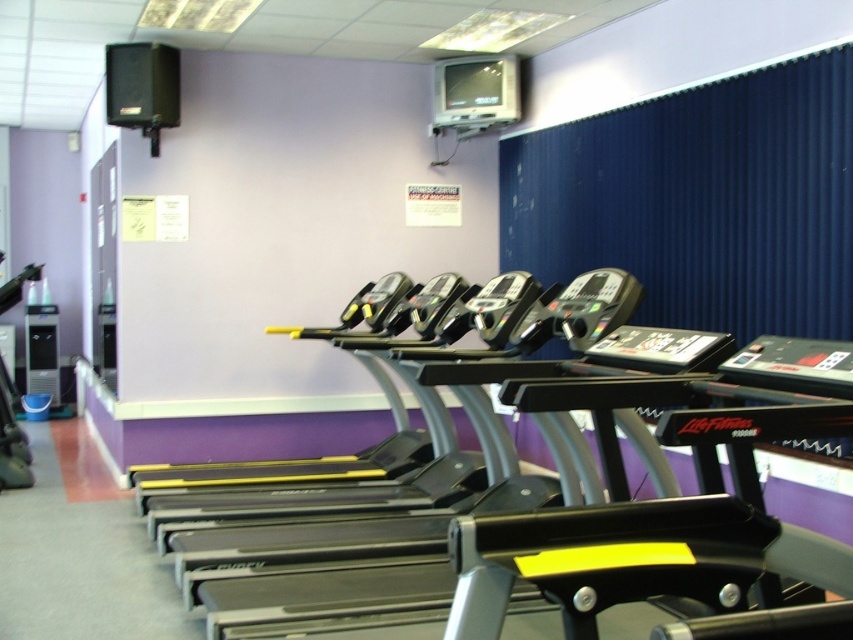
Question: Which point is closer to the camera?

Choices:
 (A) black plastic treadmills at center
 (B) blue fabric curtain at upper right

Answer: (A)

Question: Does black plastic treadmills at center come in front of blue fabric curtain at upper right?

Choices:
 (A) yes
 (B) no

Answer: (A)

Question: Is black plastic treadmills at center bigger than blue fabric curtain at upper right?

Choices:
 (A) yes
 (B) no

Answer: (A)

Question: Is black plastic treadmills at center below blue fabric curtain at upper right?

Choices:
 (A) no
 (B) yes

Answer: (B)